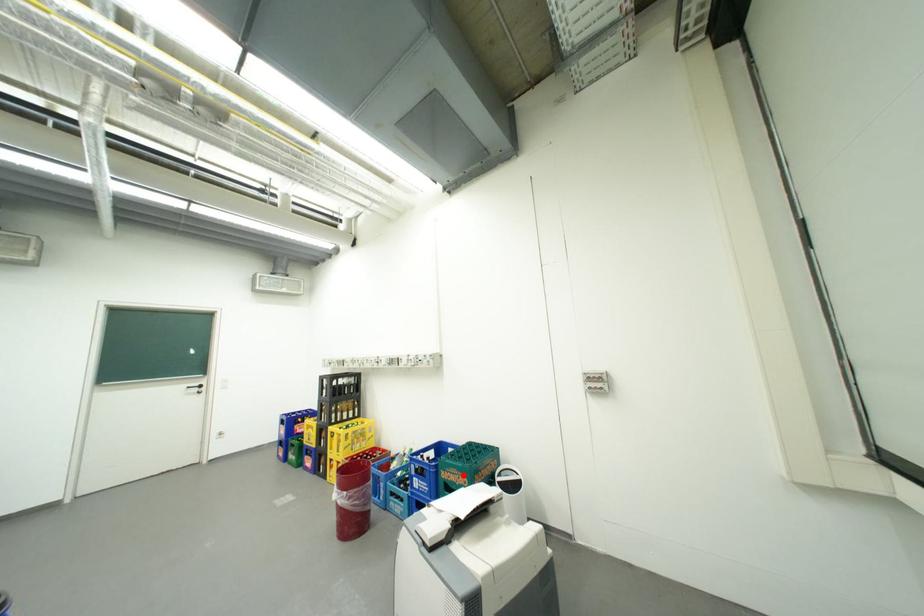
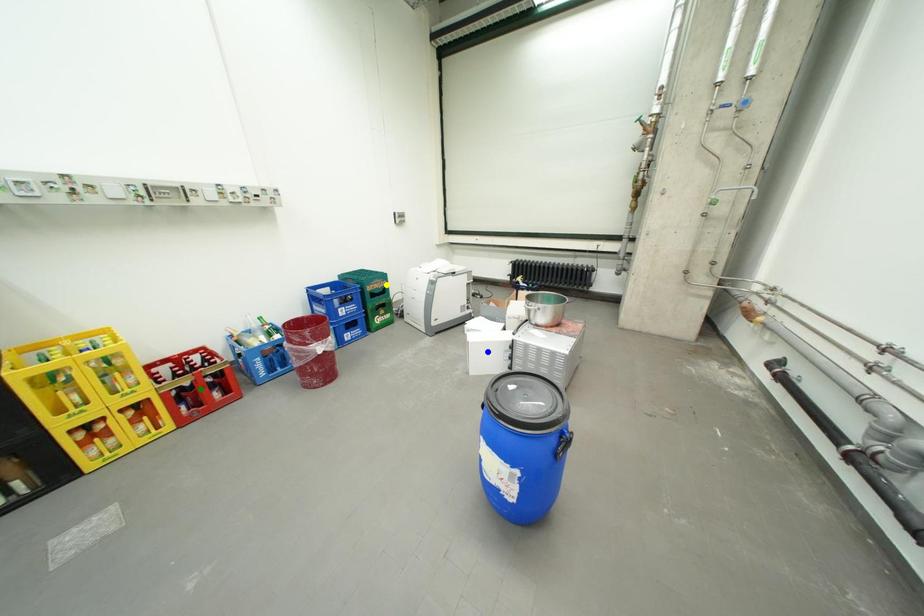
Question: I am providing you with two images of the same scene from different viewpoints. A red point is marked on the first image. You are given multiple points on the second image. Can you choose the point in image 2 that corresponds to the point in image 1?

Choices:
 (A) blue point
 (B) yellow point
 (C) green point

Answer: (B)